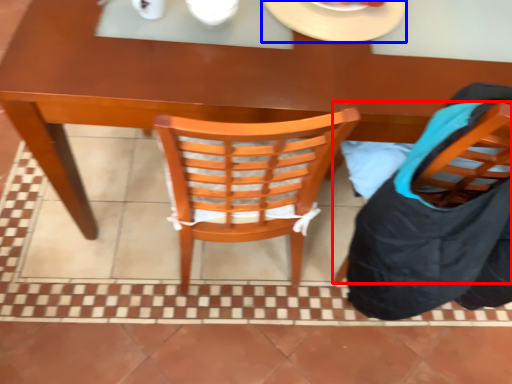
Question: Among these objects, which one is farthest to the camera, chair (highlighted by a red box) or plate (highlighted by a blue box)?

Choices:
 (A) chair
 (B) plate

Answer: (B)